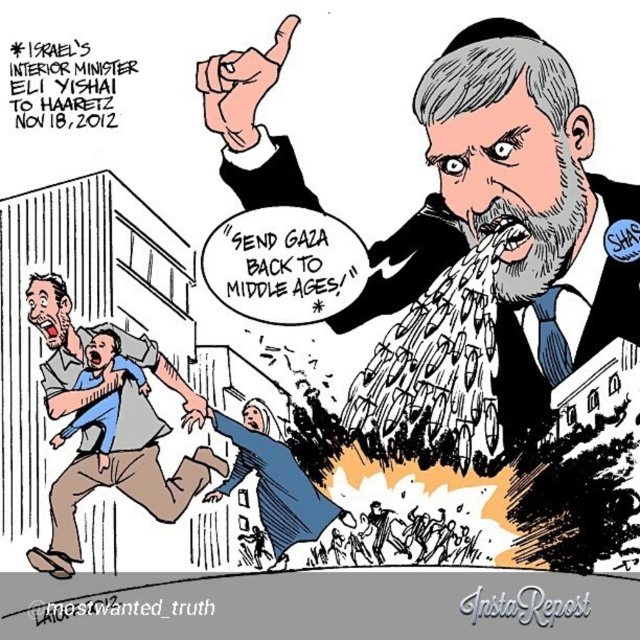
Locate an element on the screen. The image size is (640, 640). gray textured beard at center is located at coordinates (493, 260).

Between gray textured beard at center and blue cotton shirt at lower left, which one is positioned lower?

Positioned lower is blue cotton shirt at lower left.

In order to click on gray textured beard at center in this screenshot , I will do `click(493, 260)`.

Identify the location of gray textured beard at center. (493, 260).